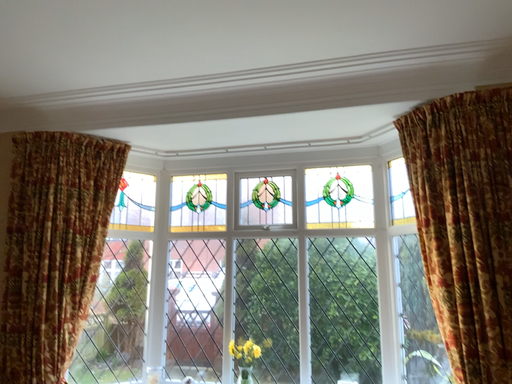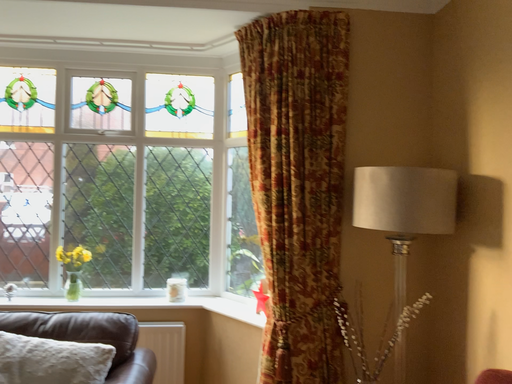
Question: Which way did the camera rotate in the video?

Choices:
 (A) rotated upward
 (B) rotated downward

Answer: (B)